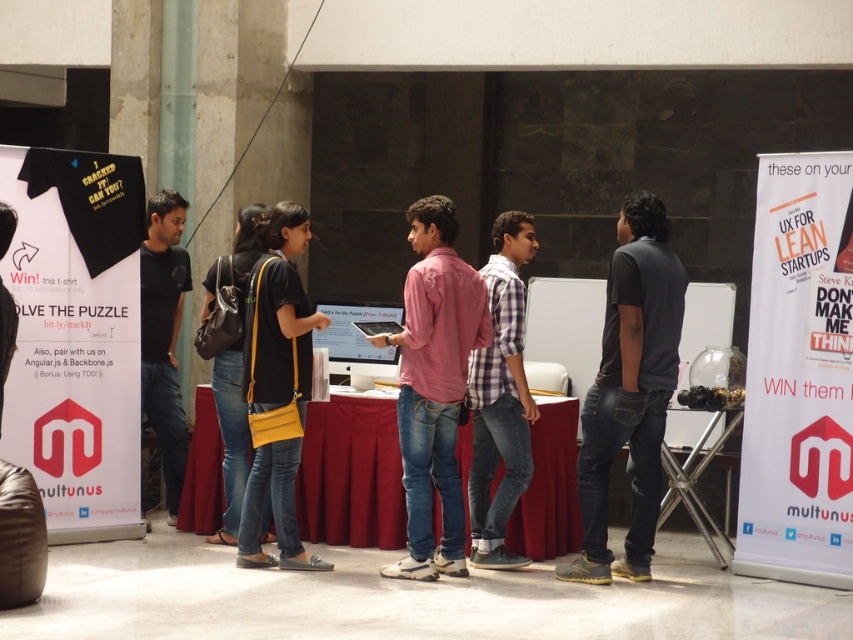
Question: Is pink cotton shirt at center above checkered fabric shirt at center?

Choices:
 (A) yes
 (B) no

Answer: (A)

Question: Does smooth red tablecloth at center have a smaller size compared to dark gray cotton t-shirt at center?

Choices:
 (A) no
 (B) yes

Answer: (B)

Question: Does dark gray cotton t-shirt at center appear on the left side of pink cotton shirt at center?

Choices:
 (A) yes
 (B) no

Answer: (B)

Question: Which point appears farthest from the camera in this image?

Choices:
 (A) (399, 440)
 (B) (625, 561)
 (C) (178, 444)

Answer: (C)

Question: Which point is farther from the camera taking this photo?

Choices:
 (A) (515, 515)
 (B) (161, 424)
 (C) (410, 208)
 (D) (651, 260)

Answer: (B)

Question: Which object is closer to the camera taking this photo?

Choices:
 (A) dark gray cotton t-shirt at center
 (B) checkered fabric shirt at center
 (C) black matte shirt at center
 (D) smooth red tablecloth at center

Answer: (A)